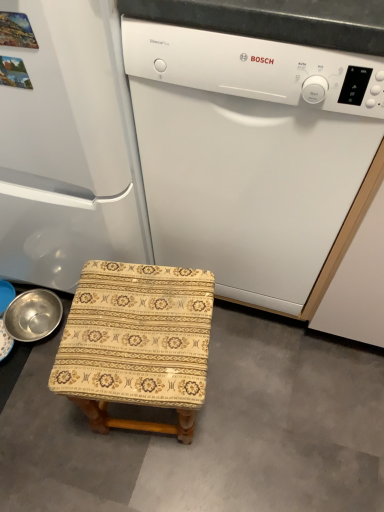
Question: Is patterned fabric stool at center in front of white matte dishwasher at center?

Choices:
 (A) no
 (B) yes

Answer: (A)

Question: From a real-world perspective, is patterned fabric stool at center over white matte dishwasher at center?

Choices:
 (A) no
 (B) yes

Answer: (A)

Question: Can you confirm if patterned fabric stool at center is shorter than white matte dishwasher at center?

Choices:
 (A) yes
 (B) no

Answer: (A)

Question: Is patterned fabric stool at center to the left of white matte dishwasher at center from the viewer's perspective?

Choices:
 (A) no
 (B) yes

Answer: (B)

Question: Is patterned fabric stool at center located outside white matte dishwasher at center?

Choices:
 (A) no
 (B) yes

Answer: (B)

Question: From the image's perspective, relative to patterned fabric stool at center, is metallic silver basin at lower left above or below?

Choices:
 (A) below
 (B) above

Answer: (B)

Question: Visually, is metallic silver basin at lower left positioned to the left or to the right of patterned fabric stool at center?

Choices:
 (A) right
 (B) left

Answer: (B)

Question: Considering the positions of metallic silver basin at lower left and patterned fabric stool at center in the image, is metallic silver basin at lower left wider or thinner than patterned fabric stool at center?

Choices:
 (A) wide
 (B) thin

Answer: (B)

Question: Is metallic silver basin at lower left in front of or behind patterned fabric stool at center in the image?

Choices:
 (A) behind
 (B) front

Answer: (A)

Question: Considering their positions, is beige fabric stool at lower left located in front of or behind white matte dishwasher at center?

Choices:
 (A) behind
 (B) front

Answer: (A)

Question: Would you say beige fabric stool at lower left is to the left or to the right of white matte dishwasher at center in the picture?

Choices:
 (A) left
 (B) right

Answer: (A)

Question: From the image's perspective, is beige fabric stool at lower left located above or below white matte dishwasher at center?

Choices:
 (A) above
 (B) below

Answer: (B)

Question: Considering the positions of beige fabric stool at lower left and white matte dishwasher at center in the image, is beige fabric stool at lower left bigger or smaller than white matte dishwasher at center?

Choices:
 (A) small
 (B) big

Answer: (A)

Question: In the image, is white matte refrigerator at left positioned in front of or behind white matte dishwasher at center?

Choices:
 (A) front
 (B) behind

Answer: (B)

Question: In terms of width, does white matte refrigerator at left look wider or thinner when compared to white matte dishwasher at center?

Choices:
 (A) wide
 (B) thin

Answer: (A)